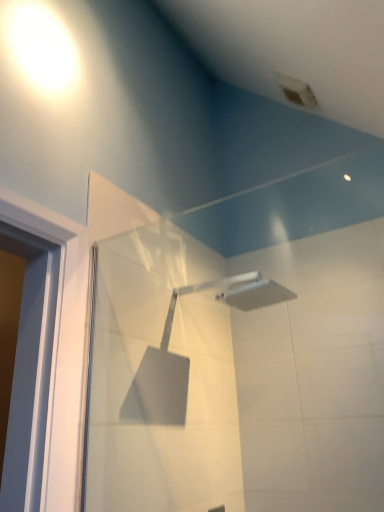
Question: Which direction should I rotate to look at silver metallic shower head at upper center?

Choices:
 (A) left
 (B) right

Answer: (B)